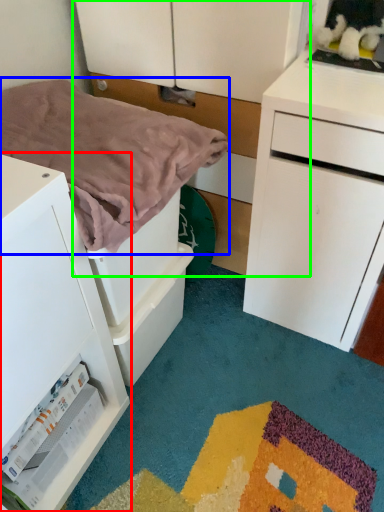
Question: Estimate the real-world distances between objects in this image. Which object is closer to chest of drawers (highlighted by a red box), blanket (highlighted by a blue box) or dresser (highlighted by a green box)?

Choices:
 (A) blanket
 (B) dresser

Answer: (A)